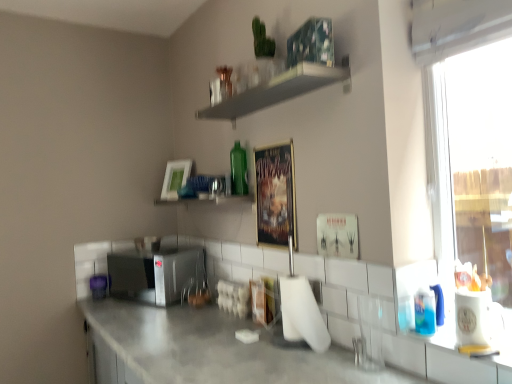
Question: Considering the positions of transparent glass window at right and green glass bottle at upper center in the image, is transparent glass window at right wider or thinner than green glass bottle at upper center?

Choices:
 (A) wide
 (B) thin

Answer: (A)

Question: From a real-world perspective, is transparent glass window at right positioned above or below green glass bottle at upper center?

Choices:
 (A) above
 (B) below

Answer: (B)

Question: Based on their relative distances, which object is farther from the green glass bottle at upper center, the second shelf positioned from the top?

Choices:
 (A) white matte picture frame at upper center, the 1th picture frame from the back
 (B) green glass bottle at upper center
 (C) metallic poster at center, the 2th picture frame when ordered from back to front
 (D) satin silver microwave at center
 (E) white matte shelf at upper center, the 1th shelf when ordered from top to bottom

Answer: (E)

Question: Considering the real-world distances, which object is farthest from the green glass bottle at upper center, the second shelf positioned from the top?

Choices:
 (A) white matte shelf at upper center, the 1th shelf when ordered from top to bottom
 (B) transparent glass window at right
 (C) white matte picture frame at upper center, which appears as the second picture frame when viewed from the right
 (D) metallic poster at center, arranged as the 1th picture frame when viewed from the right
 (E) satin silver microwave at center

Answer: (B)